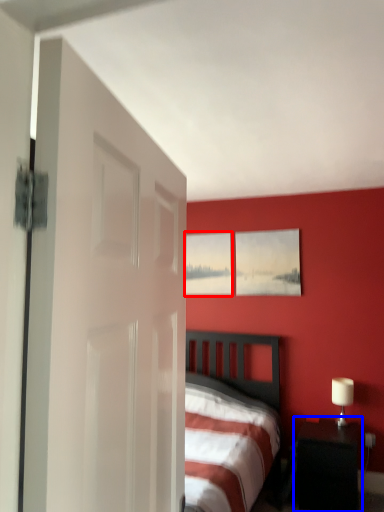
Question: Which object appears farthest to the camera in this image, picture frame (highlighted by a red box) or nightstand (highlighted by a blue box)?

Choices:
 (A) picture frame
 (B) nightstand

Answer: (A)